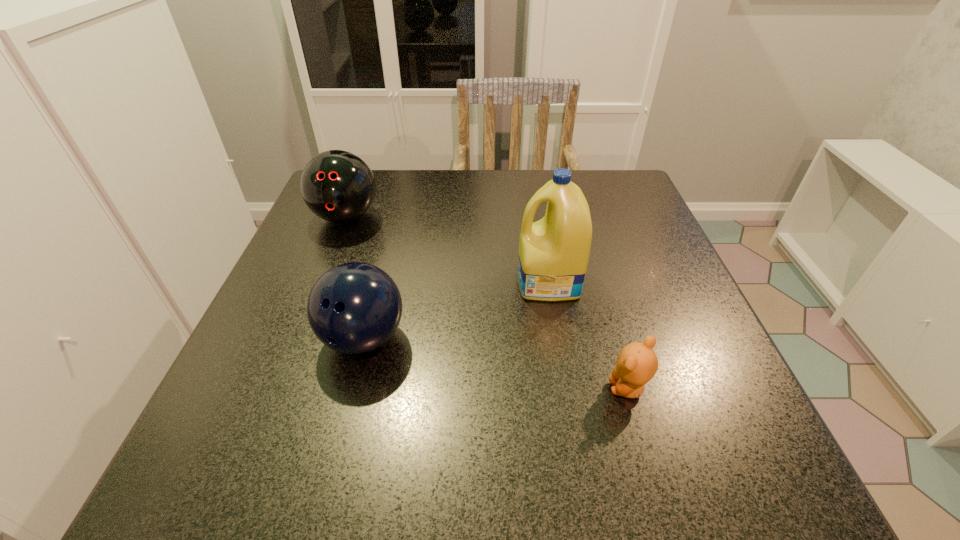
At what (x,y) coordinates should I click in order to perform the action: click on free spot between the farther bowling ball and the rightmost object. Please return your answer as a coordinate pair (x, y). The height and width of the screenshot is (540, 960). Looking at the image, I should click on (487, 303).

Identify which object is the nearest to the nearer bowling ball. Please provide its 2D coordinates. Your answer should be formatted as a tuple, i.e. [(x, y)], where the tuple contains the x and y coordinates of a point satisfying the conditions above.

[(553, 252)]

Identify the location of object that is the third closest to the rightmost object. (338, 186).

Identify the location of free space that satisfies the following two spatial constraints: 1. on the label of the third object from left to right; 2. on the surface of the nearer bowling ball near the finger holes. (558, 338).

Where is `free location that satisfies the following two spatial constraints: 1. on the label of the detergent; 2. on the surface of the nearer bowling ball near the finger holes`? The width and height of the screenshot is (960, 540). free location that satisfies the following two spatial constraints: 1. on the label of the detergent; 2. on the surface of the nearer bowling ball near the finger holes is located at coordinates (558, 338).

Identify the location of blank space that satisfies the following two spatial constraints: 1. on the label of the tallest object; 2. on the surface of the nearer bowling ball near the finger holes. (558, 338).